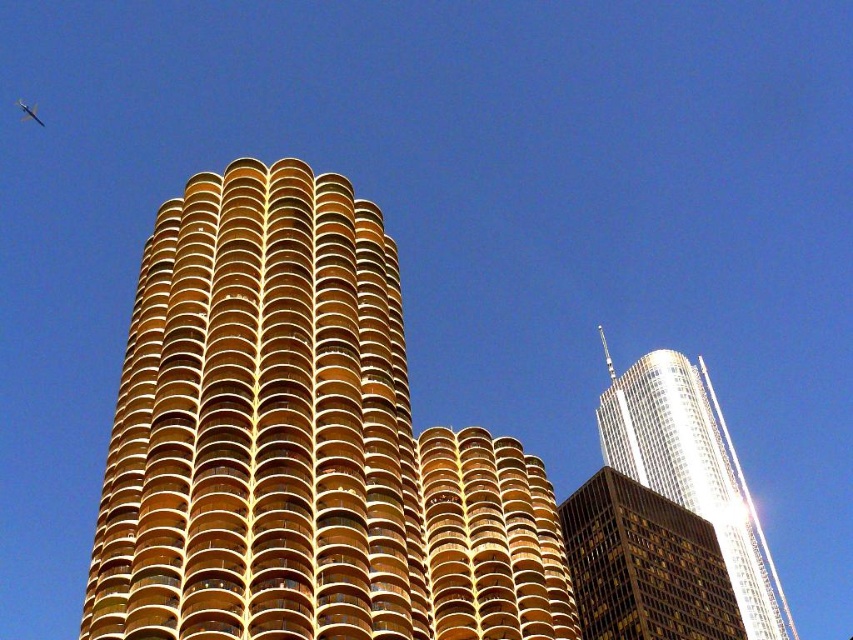
You are an architect analyzing the spatial relationship between the gold reflective glass skyscraper at center and the metallic silver airplane at upper center. Which object is positioned closer to your viewpoint?

The gold reflective glass skyscraper at center is closer to the viewer than the metallic silver airplane at upper center.

You are an architect analyzing the spatial relationship between the gold glassy building at center and the metallic silver airplane at upper center. Based on the scene, which object is closer to the viewer?

The gold glassy building at center is closer to the viewer since it is positioned in front of the metallic silver airplane at upper center.